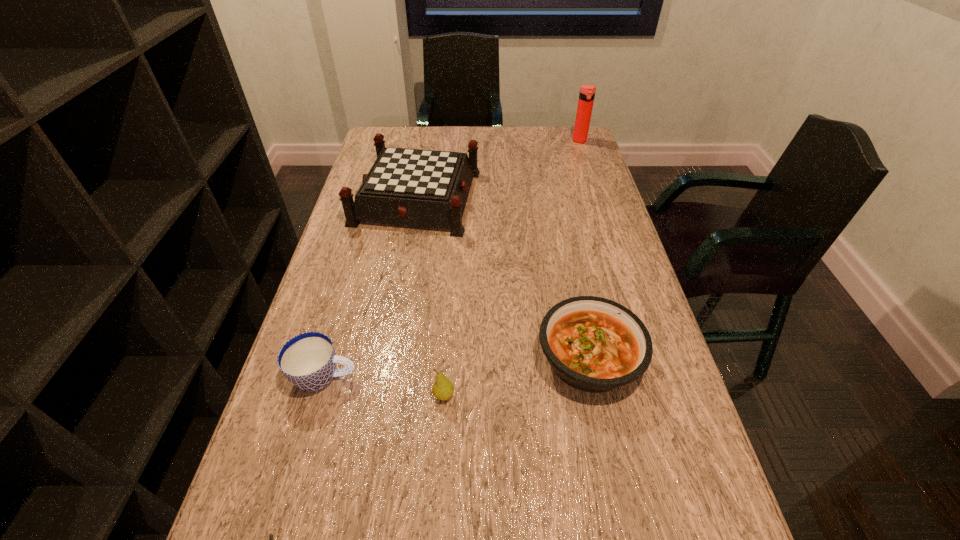
What are the coordinates of `thermos bottle` in the screenshot? It's located at (587, 92).

I want to click on the tallest object, so click(587, 92).

Identify the location of checkerboard. (425, 188).

Find the location of a particular element. the second tallest object is located at coordinates (425, 188).

Where is `pear`? Image resolution: width=960 pixels, height=540 pixels. pear is located at coordinates (443, 388).

Find the location of a particular element. This screenshot has height=540, width=960. cup is located at coordinates (308, 360).

Find the location of a particular element. Image resolution: width=960 pixels, height=540 pixels. stew is located at coordinates (593, 344).

The image size is (960, 540). I want to click on vacant space located on the left of the farthest object, so click(x=499, y=141).

Where is `blank area located on the right of the fifth nearest object`? blank area located on the right of the fifth nearest object is located at coordinates pos(602,197).

Identify the location of vacant space situated 0.260m on the left of the pear. 304,396.